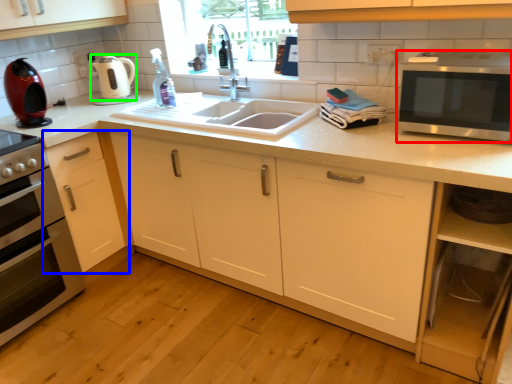
Question: Based on their relative distances, which object is nearer to microwave oven (highlighted by a red box)? Choose from cabinetry (highlighted by a blue box) and appliance (highlighted by a green box).

Choices:
 (A) cabinetry
 (B) appliance

Answer: (A)